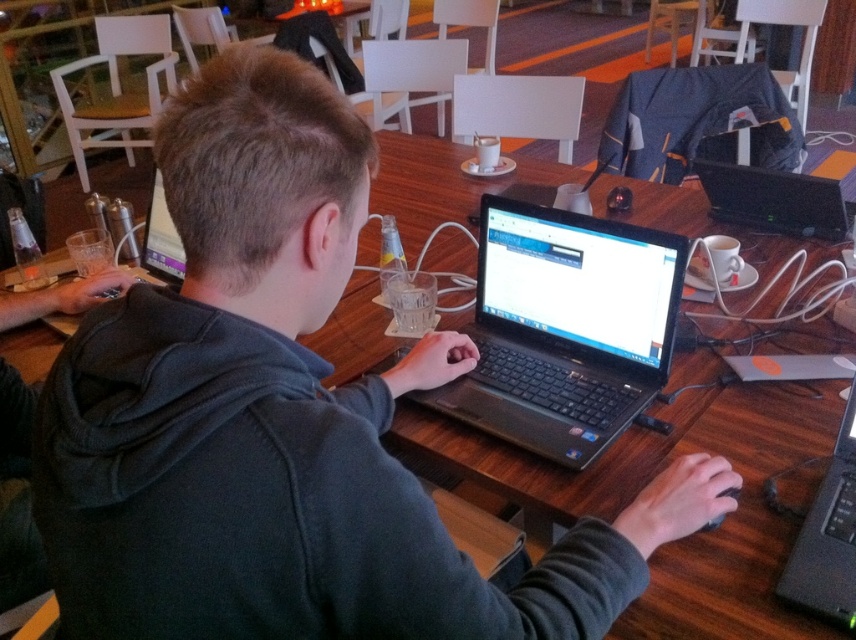
You are a guest in this workspace and need to place your own laptop between the black matte laptop at center and the black plastic laptop at upper right. Can you do this without moving either of the existing laptops?

The black matte laptop at center is below the black plastic laptop at upper right, so there is no space between them for placing another laptop without moving them.